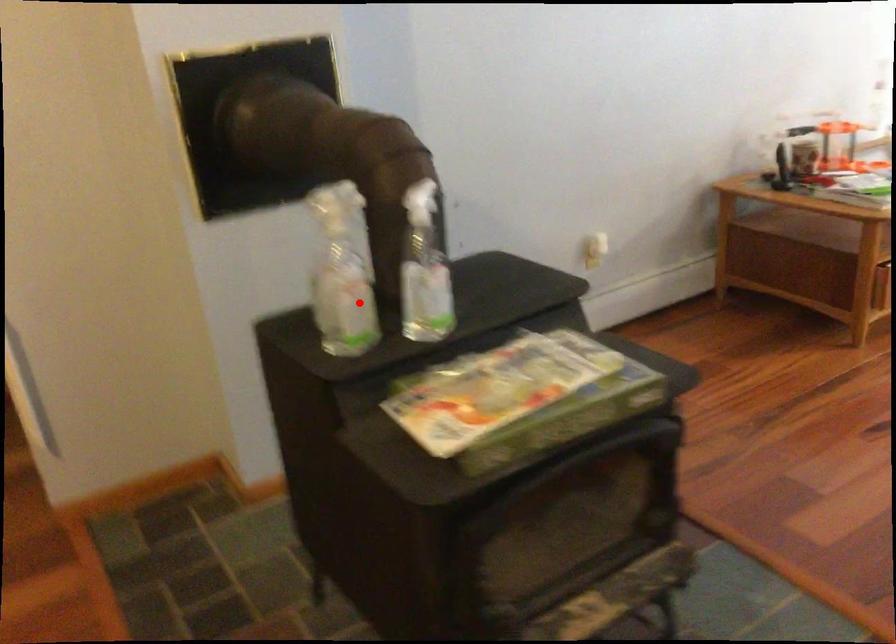
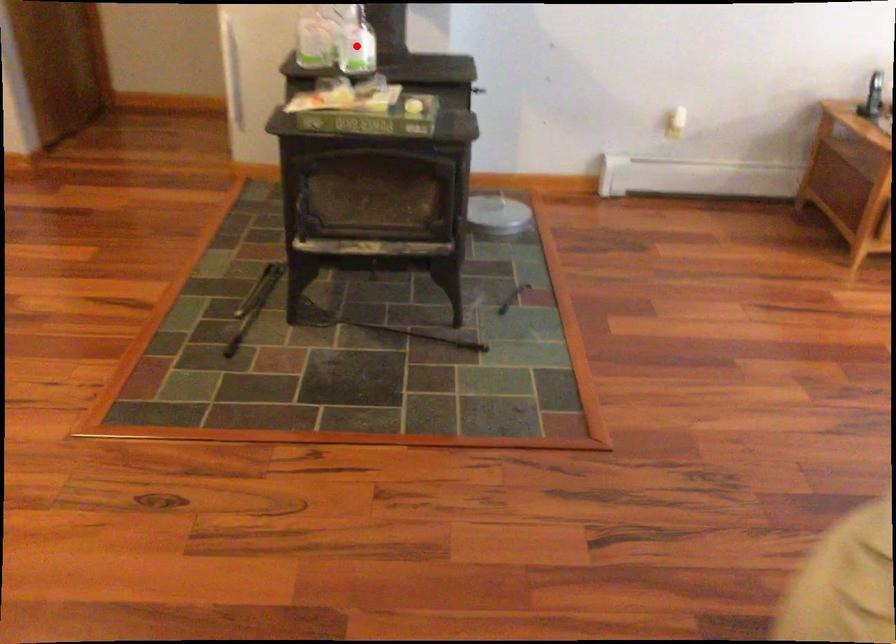
I am providing you with two images of the same scene from different viewpoints. A red point is marked on the first image and another point is marked on the second image. Does the point marked in image1 correspond to the same location as the one in image2?

No